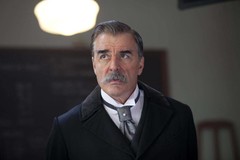
The image size is (240, 160). I want to click on wall shelf, so click(x=47, y=84).